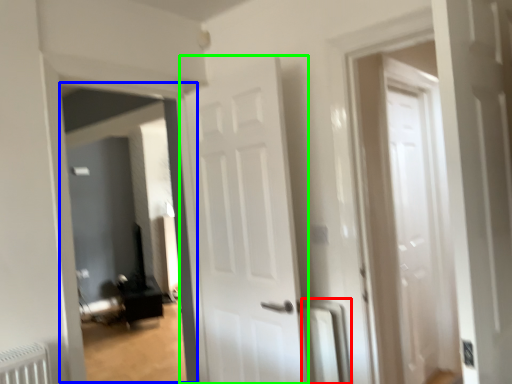
Question: Considering the real-world distances, which object is closest to radiator (highlighted by a red box)? corridor (highlighted by a blue box) or door (highlighted by a green box).

Choices:
 (A) corridor
 (B) door

Answer: (B)